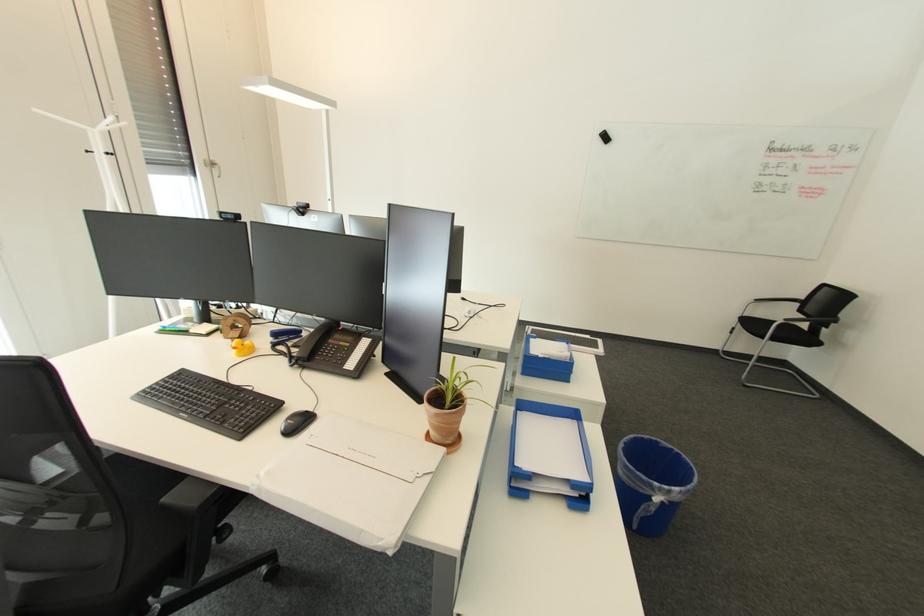
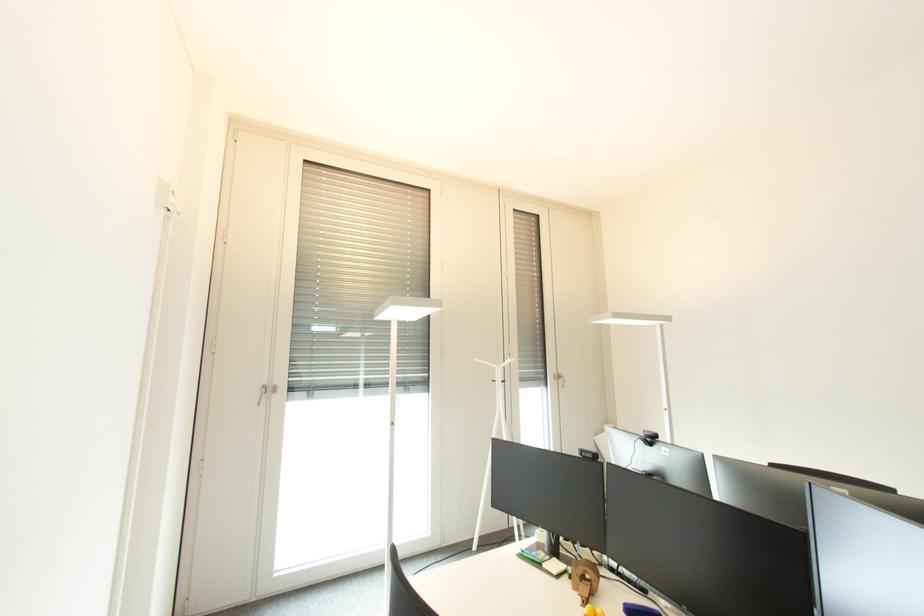
How did the camera likely rotate?

The camera's rotation is toward left-up.